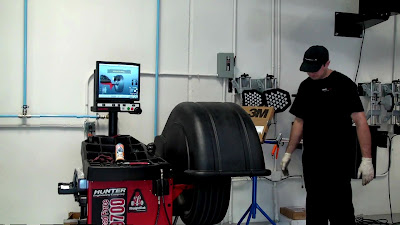
Where is `white wall`? The height and width of the screenshot is (225, 400). white wall is located at coordinates (100, 28), (296, 37).